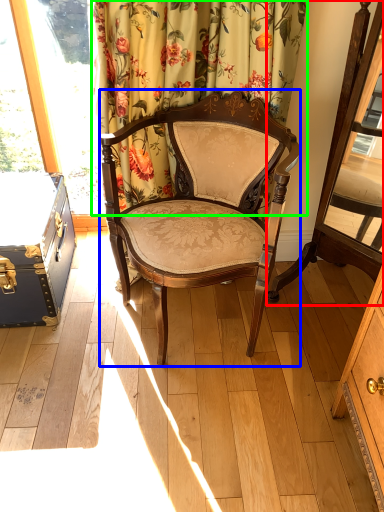
Question: Based on their relative distances, which object is nearer to swivel chair (highlighted by a red box)? Choose from chair (highlighted by a blue box) and curtain (highlighted by a green box).

Choices:
 (A) chair
 (B) curtain

Answer: (A)